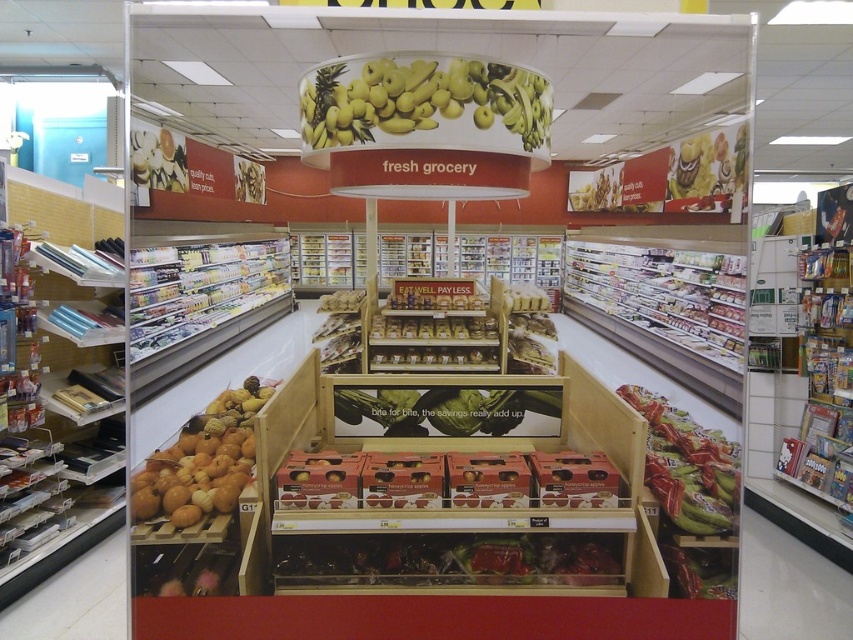
Based on the photo, you are a store employee who needs to place a new sign that is 3 feet wide between the metallic silver books at left and the metallic silver fruit at center. Can the sign fit without overlapping either object?

The metallic silver books at left and metallic silver fruit at center are 4.39 feet apart. Since the sign is 3 feet wide, there is enough space between them to place the sign without overlapping either object.

You are a customer in the grocery store and want to grab both the shiny dark chocolate at center and the orange matte fruit at lower left. Can you reach both items without moving your position?

The shiny dark chocolate at center is 14.42 inches away from the orange matte fruit at lower left. Since the distance between them is more than a typical arm length, you might need to adjust your position to reach both items comfortably.

You are a grocery store employee who needs to place a 30 inch tall ladder between the yellow matte bananas at upper center and the matte brown wooden crate at center. Can the ladder fit vertically between them without touching either object?

The distance between the yellow matte bananas at upper center and the matte brown wooden crate at center is 29.87 inches. Since the ladder is 30 inches tall, it cannot fit vertically between them as the space is slightly smaller than the ladder.